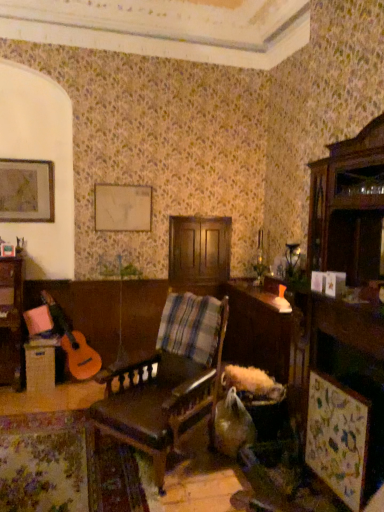
Question: Is wooden table at lower left, positioned as the 1th table in left-to-right order, smaller than matte wooden picture frame at upper left?

Choices:
 (A) no
 (B) yes

Answer: (A)

Question: From the image's perspective, is wooden table at lower left, which ranks as the second table in right-to-left order, below matte wooden picture frame at upper left?

Choices:
 (A) no
 (B) yes

Answer: (B)

Question: Is the surface of wooden table at lower left, which ranks as the second table in right-to-left order, in direct contact with matte wooden picture frame at upper left?

Choices:
 (A) yes
 (B) no

Answer: (B)

Question: Is wooden table at lower left, which ranks as the second table in right-to-left order, facing away from matte wooden picture frame at upper left?

Choices:
 (A) no
 (B) yes

Answer: (A)

Question: Is wooden table at lower left, positioned as the 1th table in left-to-right order, positioned in front of matte wooden picture frame at upper left?

Choices:
 (A) yes
 (B) no

Answer: (A)

Question: Is wooden table at center, the 1th table viewed from the right, inside or outside of matte wooden picture frame at upper left?

Choices:
 (A) inside
 (B) outside

Answer: (B)

Question: Is wooden table at center, the 1th table viewed from the right, to the left or to the right of matte wooden picture frame at upper left in the image?

Choices:
 (A) left
 (B) right

Answer: (B)

Question: From the image's perspective, is wooden table at center, the 1th table viewed from the right, above or below matte wooden picture frame at upper left?

Choices:
 (A) above
 (B) below

Answer: (B)

Question: From a real-world perspective, is wooden table at center, the 1th table viewed from the right, positioned above or below matte wooden picture frame at upper left?

Choices:
 (A) above
 (B) below

Answer: (B)

Question: Does point (130, 417) appear closer or farther from the camera than point (281, 373)?

Choices:
 (A) closer
 (B) farther

Answer: (A)

Question: Relative to wooden table at center, arranged as the 2th table when viewed from the left, is leather-like brown chair at center in front or behind?

Choices:
 (A) behind
 (B) front

Answer: (B)

Question: From the image's perspective, is leather-like brown chair at center above or below wooden table at center, arranged as the 2th table when viewed from the left?

Choices:
 (A) below
 (B) above

Answer: (A)

Question: Looking at the image, does leather-like brown chair at center seem bigger or smaller compared to wooden table at center, arranged as the 2th table when viewed from the left?

Choices:
 (A) big
 (B) small

Answer: (B)

Question: Which is correct: wooden table at lower left, which ranks as the second table in right-to-left order, is inside leather-like brown chair at center, or outside of it?

Choices:
 (A) outside
 (B) inside

Answer: (A)

Question: Is wooden table at lower left, which ranks as the second table in right-to-left order, in front of or behind leather-like brown chair at center in the image?

Choices:
 (A) front
 (B) behind

Answer: (B)